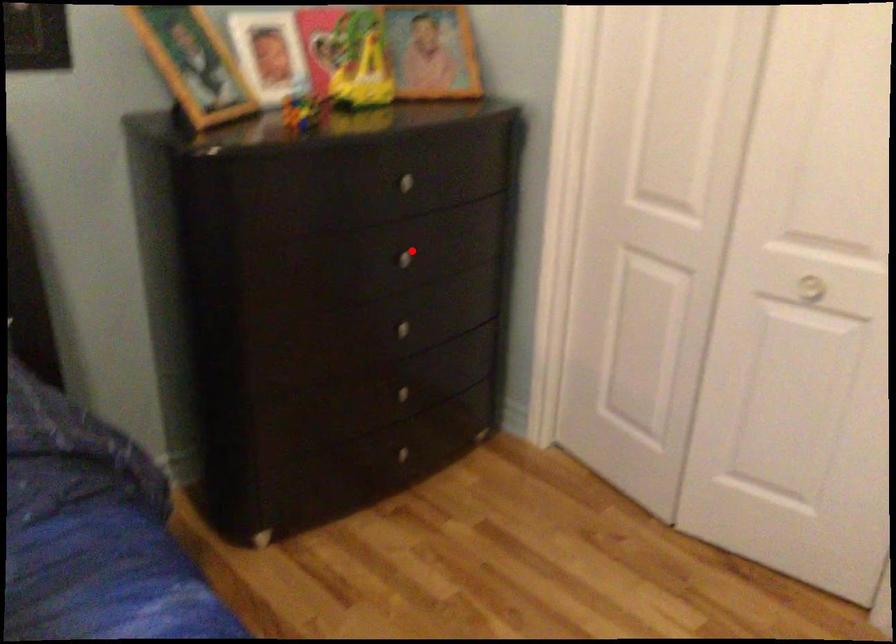
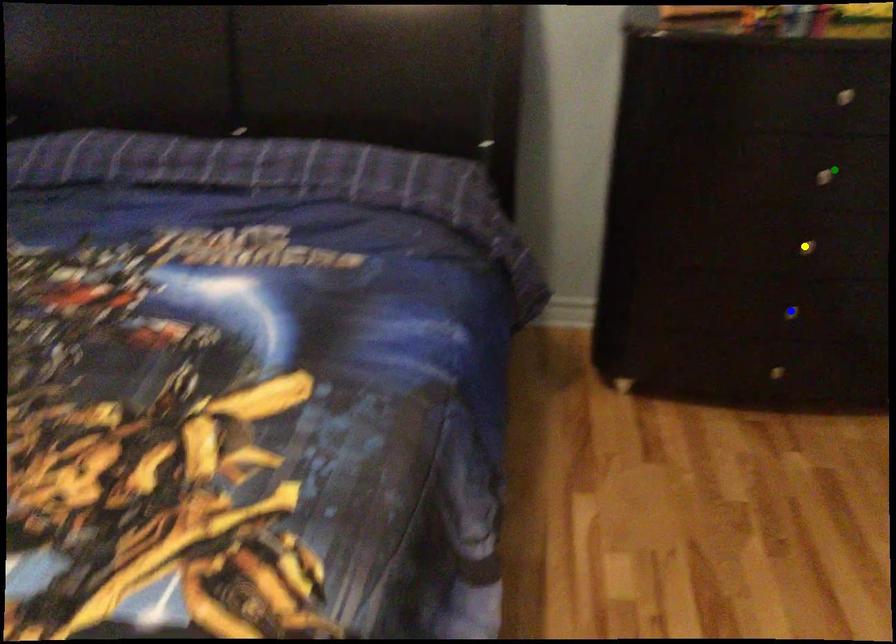
Question: I am providing you with two images of the same scene from different viewpoints. A red point is marked on the first image. You are given multiple points on the second image. Which point in image 2 represents the same 3d spot as the red point in image 1?

Choices:
 (A) blue point
 (B) green point
 (C) yellow point

Answer: (B)